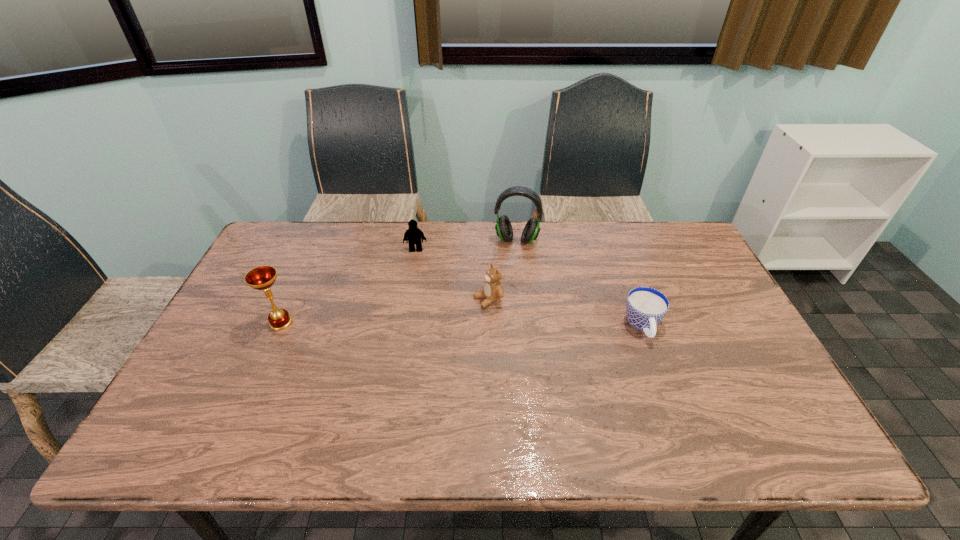
Locate an element on the screen. vacant space on the desktop that is between the leftmost object and the cup and is positioned on the front-facing side of the teddy bear is located at coordinates (423, 324).

The height and width of the screenshot is (540, 960). Identify the location of vacant space on the desktop that is between the leftmost object and the cup and is positioned on the face of the fourth object from right to left. (415, 324).

At what (x,y) coordinates should I click in order to perform the action: click on free spot on the desktop that is between the chalice and the cup and is positioned on the ear cups of the headset. Please return your answer as a coordinate pair (x, y). The width and height of the screenshot is (960, 540). Looking at the image, I should click on (505, 325).